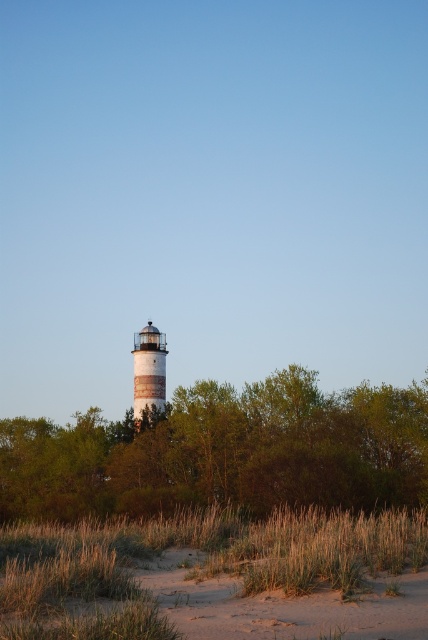
You are a photographer planning to capture the white painted wood lighthouse at center from the brown sandy beach at lower center. Given that the beach is larger, will you need to move closer to the lighthouse to ensure it occupies a significant portion of your photo?

The brown sandy beach at lower center is larger than the white painted wood lighthouse at center. To ensure the lighthouse occupies a significant portion of the photo, you should move closer to the lighthouse.

Looking at this image, you are standing at the point closest to the lighthouse in the image. Which of the two points, point (278, 496) or point (79, 605), is farther away from you?

Point (278, 496) is farther away because it is behind point (79, 605), which is closer to you.